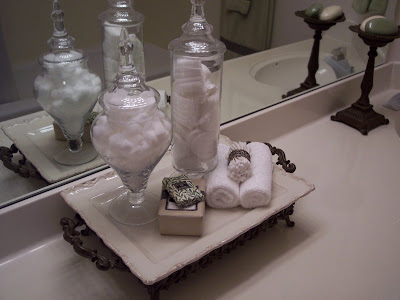
Where is `mirror on wall`? mirror on wall is located at coordinates (56, 68).